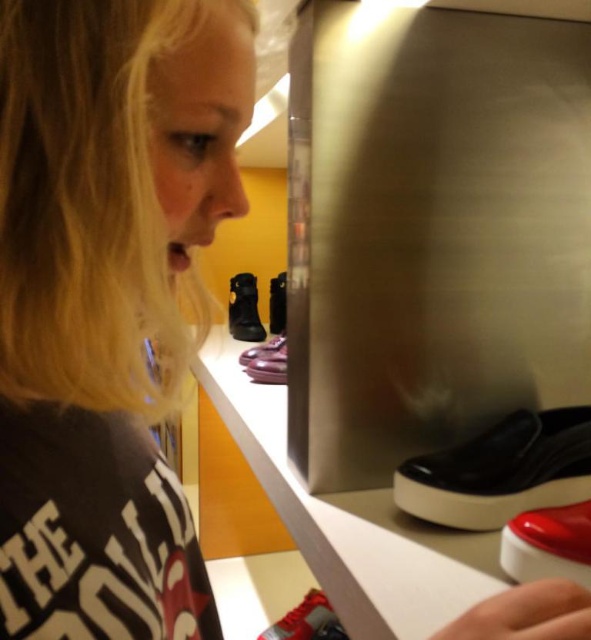
Question: Which point appears farthest from the camera in this image?

Choices:
 (A) (327, 608)
 (B) (157, 77)

Answer: (A)

Question: Is blonde hair at upper left bigger than matte purple shoe at center?

Choices:
 (A) no
 (B) yes

Answer: (B)

Question: Can you confirm if black matte shoe at lower right is bigger than shiny red shoe at lower right?

Choices:
 (A) yes
 (B) no

Answer: (A)

Question: Which object appears farthest from the camera in this image?

Choices:
 (A) shiny red sneaker at lower center
 (B) leather boot at center
 (C) black matte shoe at lower right
 (D) blonde hair at upper left

Answer: (B)

Question: From the image, what is the correct spatial relationship of black matte shoe at lower right in relation to leather boot at center?

Choices:
 (A) below
 (B) above

Answer: (A)

Question: Which object is positioned closest to the leather boot at center?

Choices:
 (A) blonde hair at upper left
 (B) black matte shoe at lower right
 (C) shiny red sneaker at lower center

Answer: (C)